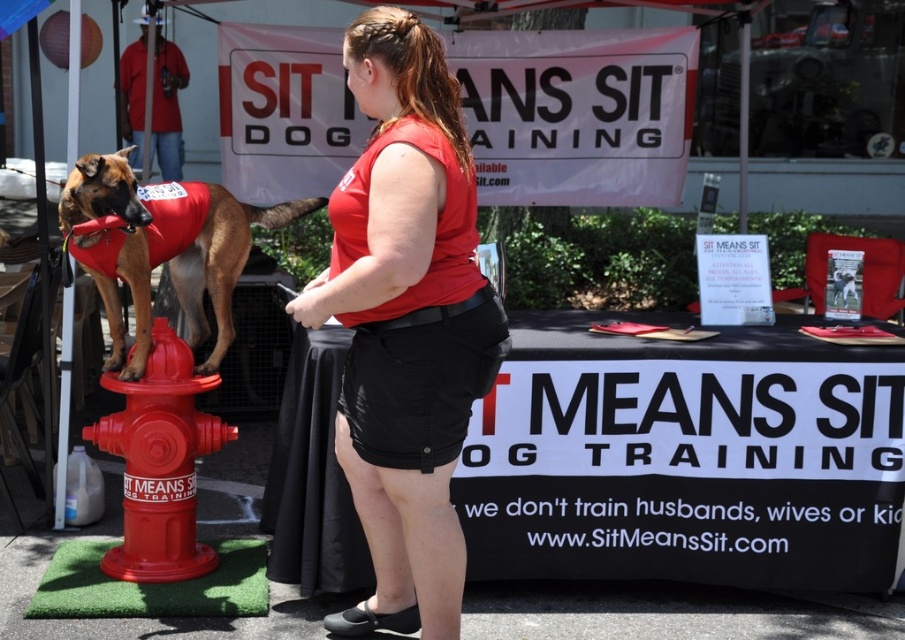
Question: Does matte red shirt at center have a greater width compared to shiny plastic fire hydrant at lower left?

Choices:
 (A) yes
 (B) no

Answer: (A)

Question: Which object is the closest to the matte red shirt at center?

Choices:
 (A) matte red vest at left
 (B) shiny plastic fire hydrant at lower left

Answer: (B)

Question: Which object is closer to the camera taking this photo?

Choices:
 (A) matte red vest at left
 (B) shiny plastic fire hydrant at lower left

Answer: (A)

Question: Which point is closer to the camera?

Choices:
 (A) (446, 212)
 (B) (157, 237)
 (C) (108, 384)

Answer: (A)

Question: Can you confirm if matte red shirt at center is positioned to the left of shiny plastic fire hydrant at lower left?

Choices:
 (A) yes
 (B) no

Answer: (B)

Question: Does matte red shirt at center have a smaller size compared to matte red vest at left?

Choices:
 (A) yes
 (B) no

Answer: (B)